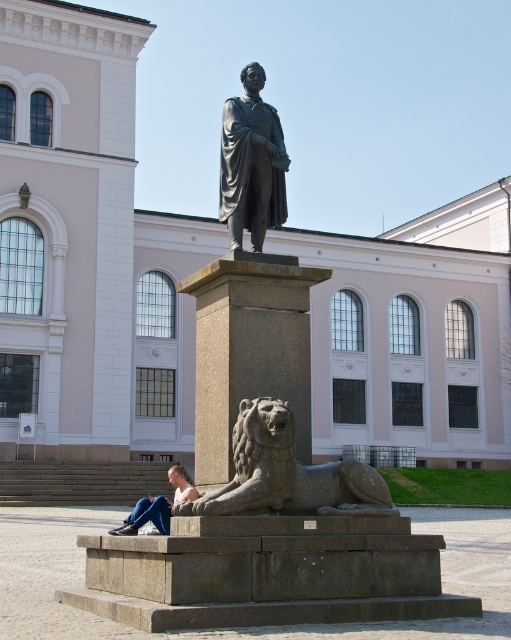
Between point (345, 481) and point (142, 506), which one is positioned behind?

Point (142, 506)

How distant is granite lion at lower center from skinny jeans at lower left?

granite lion at lower center is 5.93 meters away from skinny jeans at lower left.

Between point (381, 493) and point (178, 483), which one is positioned in front?

Point (381, 493) is more forward.

Identify the location of granite lion at lower center. (287, 474).

Can you confirm if bronze statue at center is positioned below skinny jeans at lower left?

Actually, bronze statue at center is above skinny jeans at lower left.

Describe the element at coordinates (251, 163) in the screenshot. This screenshot has height=640, width=511. I see `bronze statue at center` at that location.

Which is in front, point (264, 134) or point (174, 492)?

Point (264, 134)

Where is `bronze statue at center`? The width and height of the screenshot is (511, 640). bronze statue at center is located at coordinates (251, 163).

Consider the image. Between granite lion at lower center and bronze statue at center, which one has more height?

With more height is bronze statue at center.

Based on the photo, is granite lion at lower center positioned at the back of bronze statue at center?

No, it is in front of bronze statue at center.

Which is in front, point (285, 465) or point (224, 161)?

Positioned in front is point (285, 465).

Find the location of a particular element. Image resolution: width=511 pixels, height=640 pixels. granite lion at lower center is located at coordinates (287, 474).